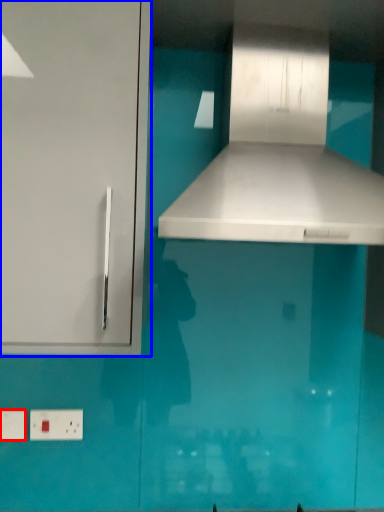
Question: Which object appears closest to the camera in this image, electric outlet (highlighted by a red box) or cabinetry (highlighted by a blue box)?

Choices:
 (A) electric outlet
 (B) cabinetry

Answer: (B)